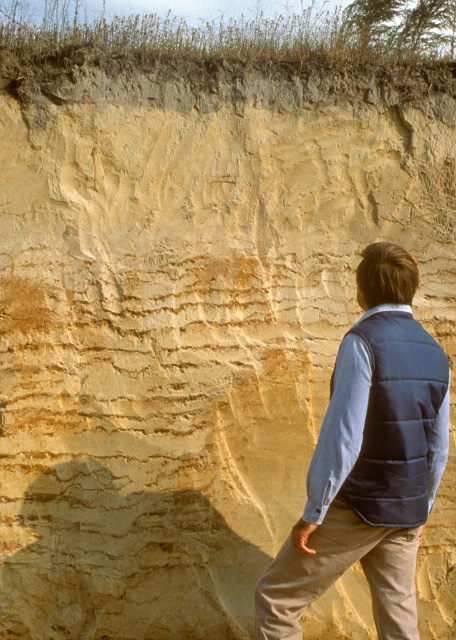
Based on the photo, is blue quilted vest at center bigger than dark blue quilted vest at center?

Yes.

Looking at this image, which of these two, blue quilted vest at center or dark blue quilted vest at center, stands taller?

blue quilted vest at center is taller.

Who is more distant from viewer, (423,369) or (342,436)?

The point (423,369) is behind.

I want to click on blue quilted vest at center, so click(368, 461).